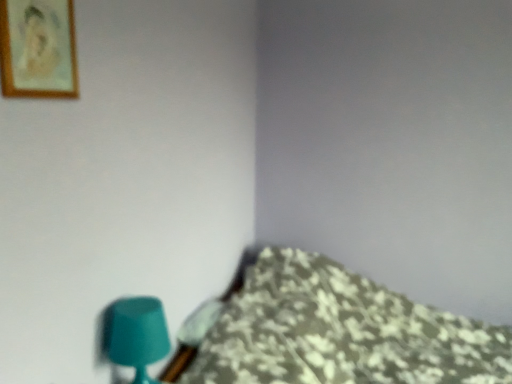
Question: Can you confirm if wooden framed portrait at upper left is wider than teal matte table lamp at lower left?

Choices:
 (A) no
 (B) yes

Answer: (A)

Question: From the image's perspective, does wooden framed portrait at upper left appear higher than teal matte table lamp at lower left?

Choices:
 (A) yes
 (B) no

Answer: (A)

Question: Is wooden framed portrait at upper left behind teal matte table lamp at lower left?

Choices:
 (A) no
 (B) yes

Answer: (A)

Question: Is wooden framed portrait at upper left to the left of teal matte table lamp at lower left from the viewer's perspective?

Choices:
 (A) no
 (B) yes

Answer: (B)

Question: Is wooden framed portrait at upper left beside teal matte table lamp at lower left?

Choices:
 (A) yes
 (B) no

Answer: (B)

Question: Is teal matte table lamp at lower left taller or shorter than floral fabric bedspread at lower right?

Choices:
 (A) tall
 (B) short

Answer: (B)

Question: Do you think teal matte table lamp at lower left is within floral fabric bedspread at lower right, or outside of it?

Choices:
 (A) outside
 (B) inside

Answer: (A)

Question: Is point (104, 326) closer or farther from the camera than point (227, 291)?

Choices:
 (A) farther
 (B) closer

Answer: (B)

Question: Is teal matte table lamp at lower left bigger or smaller than floral fabric bedspread at lower right?

Choices:
 (A) small
 (B) big

Answer: (A)

Question: From their relative heights in the image, would you say floral fabric bedspread at lower right is taller or shorter than teal matte table lamp at lower left?

Choices:
 (A) tall
 (B) short

Answer: (A)

Question: Is floral fabric bedspread at lower right in front of or behind teal matte table lamp at lower left in the image?

Choices:
 (A) behind
 (B) front

Answer: (B)

Question: Is floral fabric bedspread at lower right inside the boundaries of teal matte table lamp at lower left, or outside?

Choices:
 (A) inside
 (B) outside

Answer: (B)

Question: Does point (362, 367) appear closer or farther from the camera than point (141, 316)?

Choices:
 (A) closer
 (B) farther

Answer: (B)

Question: Is point pos(44,96) closer or farther from the camera than point pos(106,336)?

Choices:
 (A) closer
 (B) farther

Answer: (A)

Question: Considering their positions, is wooden framed portrait at upper left located in front of or behind teal matte table lamp at lower left?

Choices:
 (A) front
 (B) behind

Answer: (A)